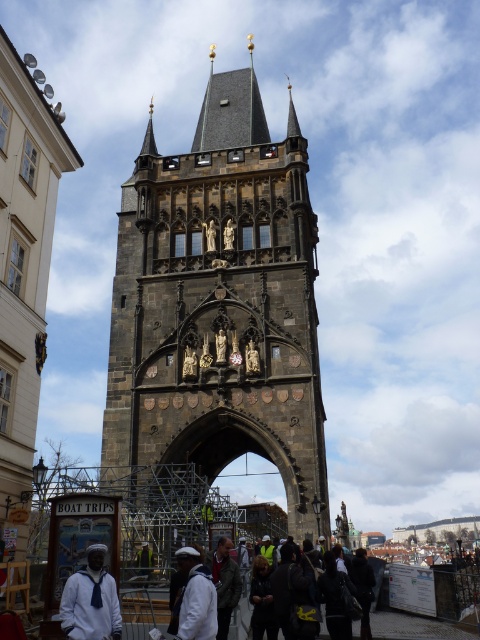
You are an architect planning to install a decorative banner between the dark gray stone spire at center top and the dark gray jacket at center. Considering their widths, which object should the banner be anchored to for better stability?

The banner should be anchored to the dark gray stone spire at center top because its width is larger than the dark gray jacket at center, providing a more stable anchor point.

You are standing in front of the historic stone tower and notice two objects of interest. Which object is positioned to the left when looking at the dark gray stone spire at center top and the dark gray jacket at center?

The dark gray stone spire at center top is to the left of the dark gray jacket at center.

You are a tour guide leading a group near the historic stone tower. You notice two visitors wearing white matte sailor suit at lower left and white matte jacket at lower center. If you want to give both of them a souvenir, which visitor is closer to you if you are standing at the central arched gateway?

The white matte sailor suit at lower left is closer to you than the white matte jacket at lower center since it is only 12.33 feet away from the jacket, but the exact distance from the gateway isn